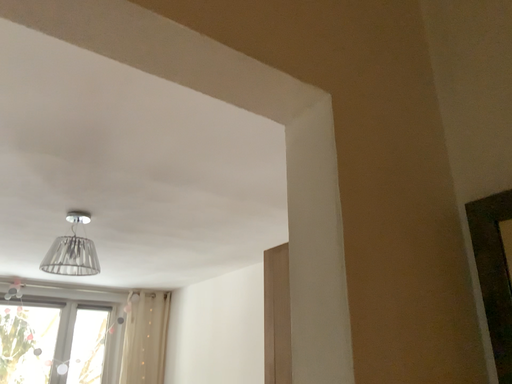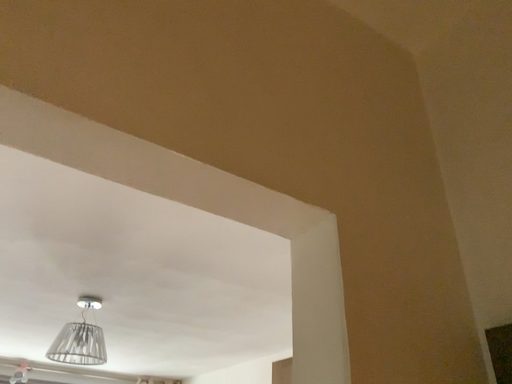
Question: Which way did the camera rotate in the video?

Choices:
 (A) rotated downward
 (B) rotated upward

Answer: (B)